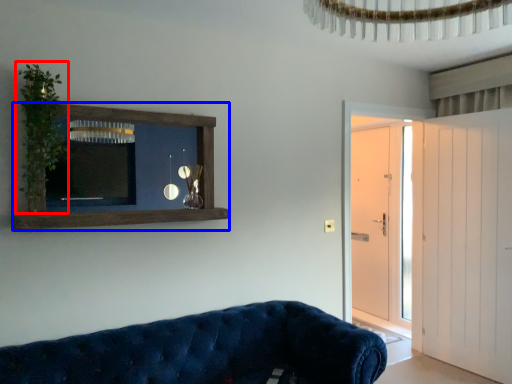
Question: Which point is further to the camera, plant (highlighted by a red box) or shelf (highlighted by a blue box)?

Choices:
 (A) plant
 (B) shelf

Answer: (B)